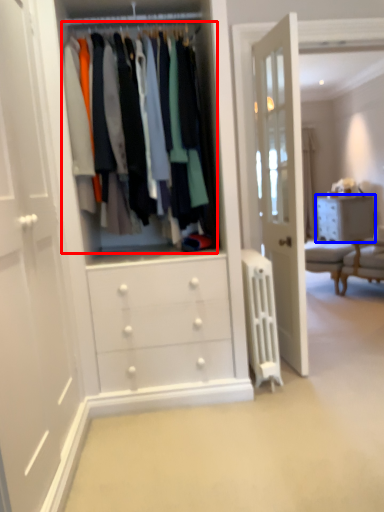
Question: Which object is further to the camera taking this photo, closet (highlighted by a red box) or chest of drawers (highlighted by a blue box)?

Choices:
 (A) closet
 (B) chest of drawers

Answer: (B)